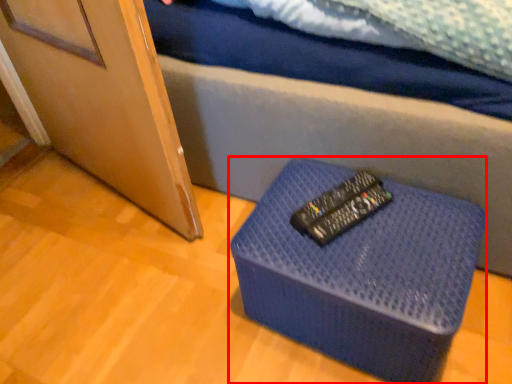
Question: From the image's perspective, where is furniture (annotated by the red box) located relative to control?

Choices:
 (A) above
 (B) below

Answer: (B)